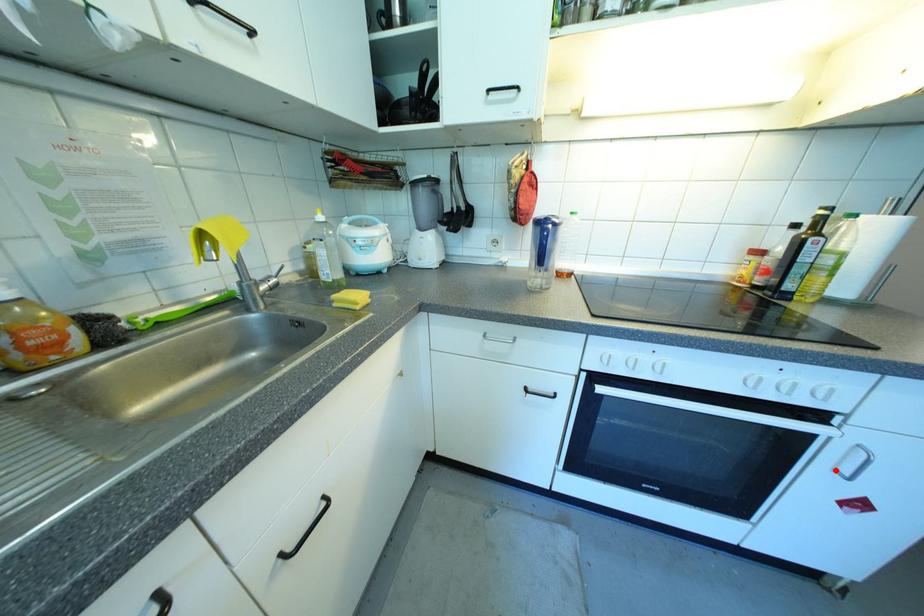
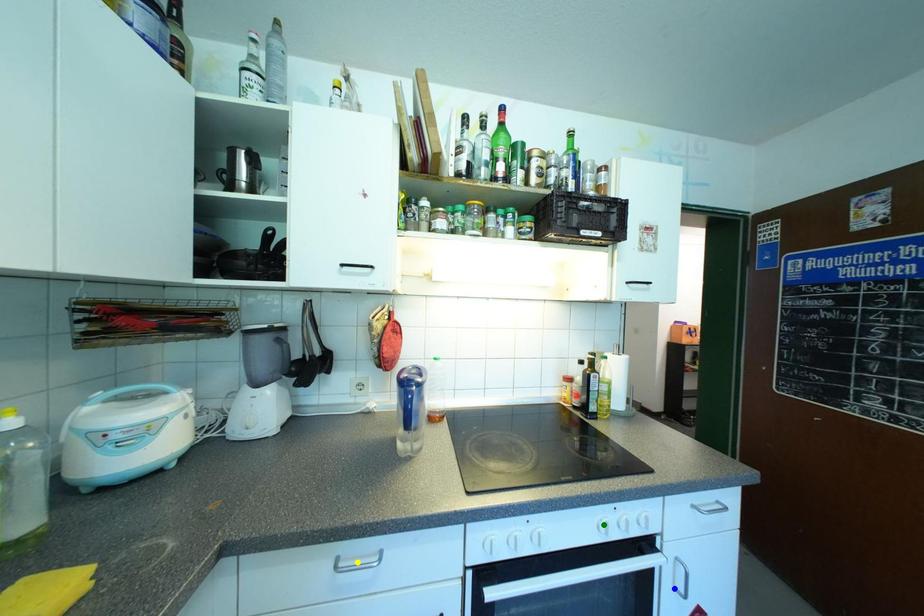
Question: I am providing you with two images of the same scene from different viewpoints. A red point is marked on the first image. You are given multiple points on the second image. In image 2, which mark is for the same physical point as the one in image 1?

Choices:
 (A) green point
 (B) yellow point
 (C) blue point

Answer: (C)